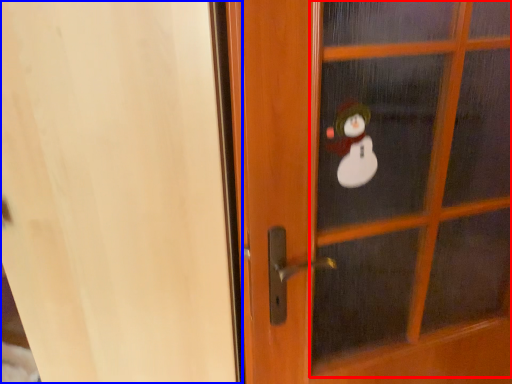
Question: Which object appears farthest to the camera in this image, screen door (highlighted by a red box) or screen door (highlighted by a blue box)?

Choices:
 (A) screen door
 (B) screen door

Answer: (A)